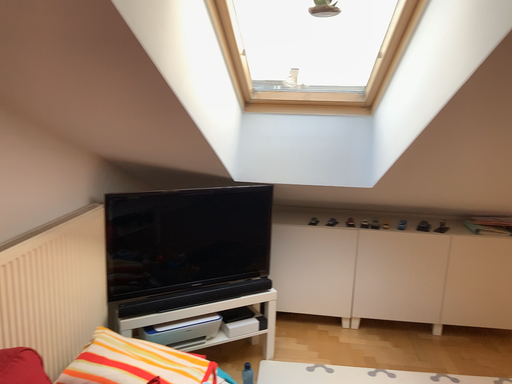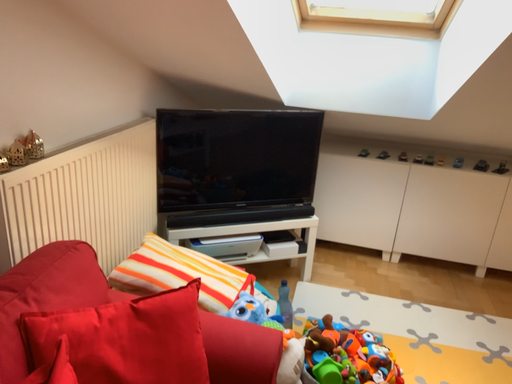
Question: Which way did the camera rotate in the video?

Choices:
 (A) rotated downward
 (B) rotated upward

Answer: (A)